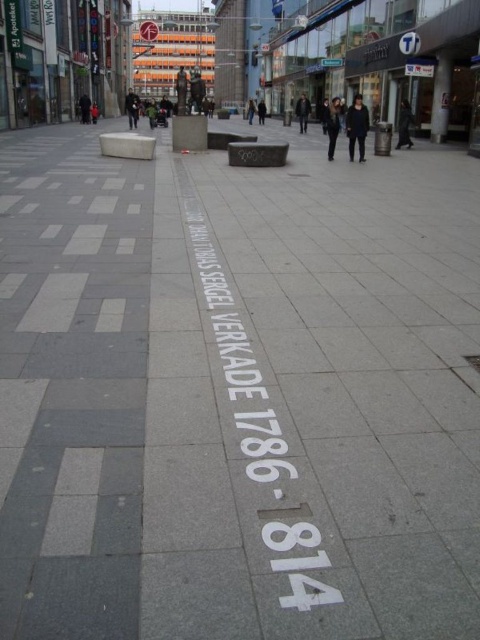
Question: Which point is closer to the camera?

Choices:
 (A) (148, 24)
 (B) (214, 304)

Answer: (B)

Question: From the image, what is the correct spatial relationship of white painted text at center in relation to white plastic sign at upper center?

Choices:
 (A) left
 (B) right

Answer: (B)

Question: Which point is farther to the camera?

Choices:
 (A) white painted text at center
 (B) white plastic sign at upper center

Answer: (B)

Question: Is white painted text at center smaller than white plastic sign at upper center?

Choices:
 (A) no
 (B) yes

Answer: (B)

Question: Does white painted text at center appear on the right side of white plastic sign at upper center?

Choices:
 (A) yes
 (B) no

Answer: (A)